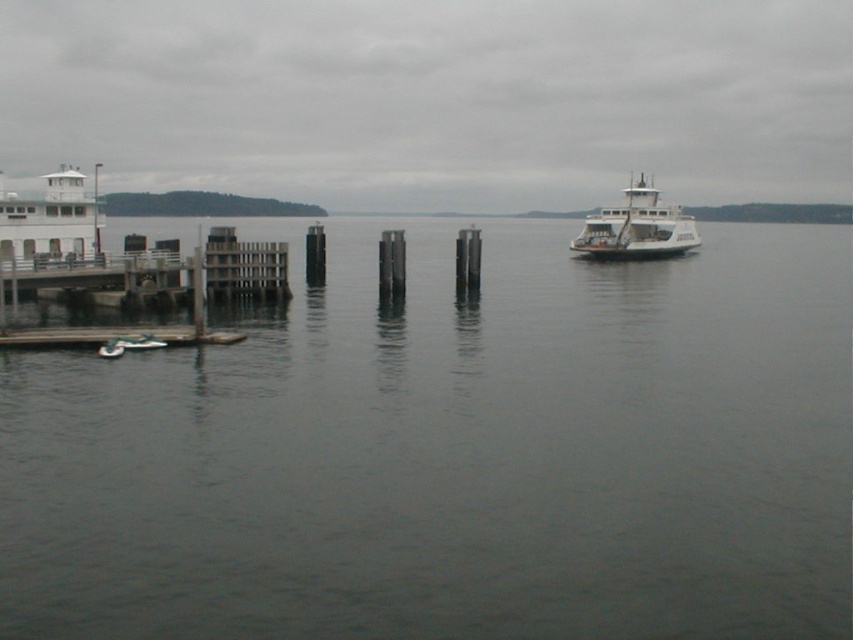
You are standing on the wooden pilings in the middle ground of the waterfront scene. You see two ferries in front of you, the white matte ferry at center and the white matte ferry at right. Which ferry is closer to you?

The white matte ferry at center is closer to you because it is further to the viewer than the white matte ferry at right.

Based on the photo, you are a photographer planning to capture the white matte ferry at center and the gray water at center in a single shot. Based on their positions, which object should you focus on first to ensure both are in frame?

The gray water at center is shorter than the white matte ferry at center, so you should focus on the white matte ferry at center first to ensure both fit within the frame.